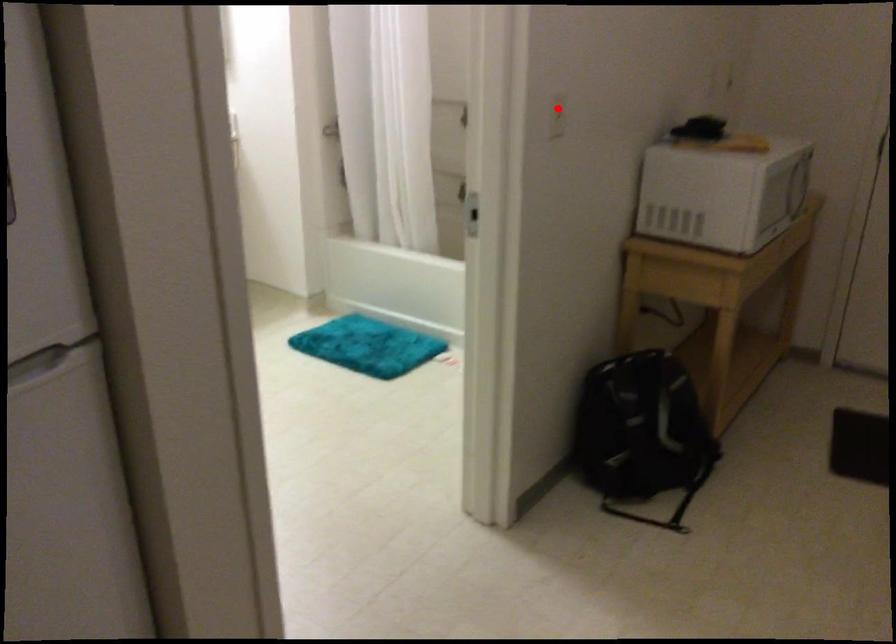
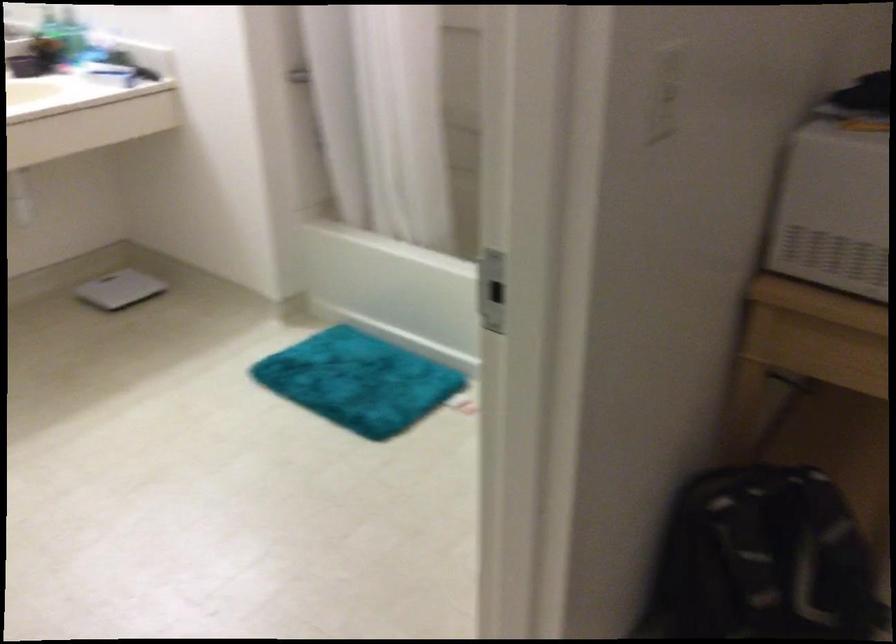
Question: A red point is marked in image1. In image2, is the corresponding 3D point closer to the camera or farther? Reply with the corresponding letter.

Choices:
 (A) The corresponding 3D point is closer.
 (B) The corresponding 3D point is farther.

Answer: (A)